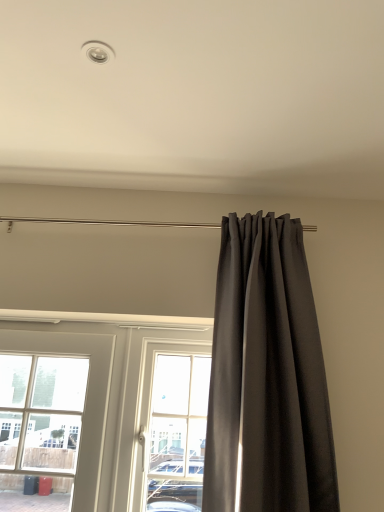
Image resolution: width=384 pixels, height=512 pixels. Describe the element at coordinates (267, 376) in the screenshot. I see `dark gray fabric curtain at right` at that location.

The width and height of the screenshot is (384, 512). Identify the location of dark gray fabric curtain at right. (267, 376).

In order to face clear glass door at center, should I rotate leftwards or rightwards?

Rotate left and turn 2.572 degrees.

What do you see at coordinates (178, 433) in the screenshot?
I see `clear glass door at center` at bounding box center [178, 433].

Find the location of a particular element. clear glass door at center is located at coordinates (178, 433).

You are a GUI agent. You are given a task and a screenshot of the screen. Output one action in this format:
    pyautogui.click(x=<x>, y=<y>)
    Task: Click on the dark gray fabric curtain at right
    The height and width of the screenshot is (512, 384).
    Given the screenshot: What is the action you would take?
    pyautogui.click(x=267, y=376)

Can you confirm if dark gray fabric curtain at right is positioned to the right of clear glass door at center?

Yes.

In the scene shown: Is dark gray fabric curtain at right positioned in front of clear glass door at center?

Yes, dark gray fabric curtain at right is in front of clear glass door at center.

Is point (239, 441) farther from camera compared to point (162, 422)?

That is False.

From the image's perspective, between dark gray fabric curtain at right and clear glass door at center, which one is located above?

dark gray fabric curtain at right, from the image's perspective.

From a real-world perspective, which object stands above the other?

dark gray fabric curtain at right is physically above.

Is dark gray fabric curtain at right thinner than clear glass door at center?

No, dark gray fabric curtain at right is not thinner than clear glass door at center.

Considering the sizes of objects dark gray fabric curtain at right and clear glass door at center in the image provided, who is shorter, dark gray fabric curtain at right or clear glass door at center?

Standing shorter between the two is clear glass door at center.

Between dark gray fabric curtain at right and clear glass door at center, which one has larger size?

dark gray fabric curtain at right.

Do you think dark gray fabric curtain at right is within clear glass door at center, or outside of it?

dark gray fabric curtain at right is not enclosed by clear glass door at center.

Is dark gray fabric curtain at right positioned far away from clear glass door at center?

Yes.

Does dark gray fabric curtain at right turn towards clear glass door at center?

No.

Measure the distance from dark gray fabric curtain at right to clear glass door at center.

dark gray fabric curtain at right is 1.75 meters away from clear glass door at center.

Image resolution: width=384 pixels, height=512 pixels. What are the coordinates of `bay window on the left side of dark gray fabric curtain at right` in the screenshot? It's located at (178, 433).

Is clear glass door at center at the left side of dark gray fabric curtain at right?

Indeed, clear glass door at center is positioned on the left side of dark gray fabric curtain at right.

Considering their positions, is clear glass door at center located in front of or behind dark gray fabric curtain at right?

In the image, clear glass door at center appears behind dark gray fabric curtain at right.

Between point (178, 463) and point (259, 470), which one is positioned in front?

The point (259, 470) is more forward.

From the image's perspective, which is below, clear glass door at center or dark gray fabric curtain at right?

clear glass door at center appears lower in the image.

From a real-world perspective, is clear glass door at center under dark gray fabric curtain at right?

Yes, from a real-world perspective, clear glass door at center is under dark gray fabric curtain at right.

Between clear glass door at center and dark gray fabric curtain at right, which one has smaller width?

Thinner between the two is clear glass door at center.

Between clear glass door at center and dark gray fabric curtain at right, which one has less height?

Standing shorter between the two is clear glass door at center.

Which of these two, clear glass door at center or dark gray fabric curtain at right, is smaller?

clear glass door at center is smaller.

Consider the image. Can dark gray fabric curtain at right be found inside clear glass door at center?

No, dark gray fabric curtain at right is not a part of clear glass door at center.

Is clear glass door at center directly adjacent to dark gray fabric curtain at right?

No, clear glass door at center is not beside dark gray fabric curtain at right.

Is clear glass door at center facing towards dark gray fabric curtain at right?

No, clear glass door at center is not turned towards dark gray fabric curtain at right.

The height and width of the screenshot is (512, 384). In the image, there is a dark gray fabric curtain at right. Identify the location of bay window below it (from a real-world perspective). (178, 433).

In the image, there is a dark gray fabric curtain at right. In order to click on bay window below it (from a real-world perspective) in this screenshot , I will do `click(178, 433)`.

In order to click on curtain in front of the clear glass door at center in this screenshot , I will do `click(267, 376)`.